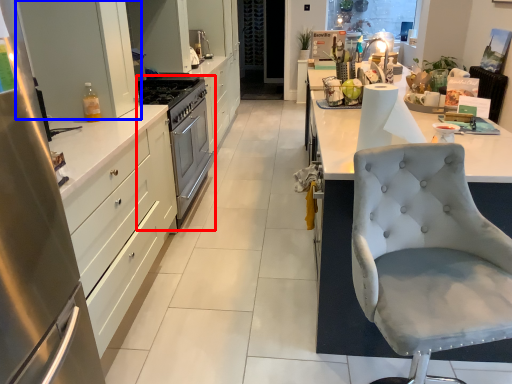
Question: Which of the following is the farthest to the observer, sink (highlighted by a red box) or cabinetry (highlighted by a blue box)?

Choices:
 (A) sink
 (B) cabinetry

Answer: (A)